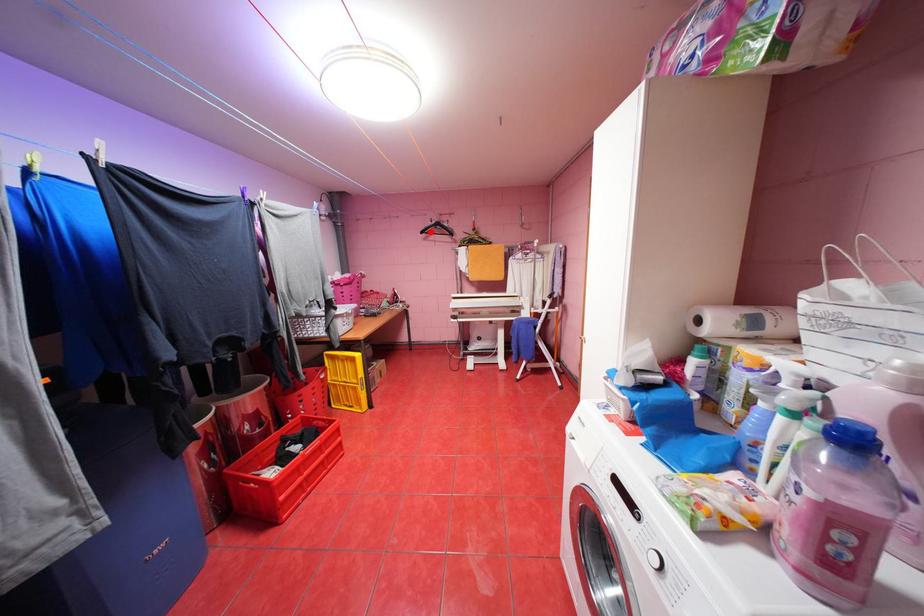
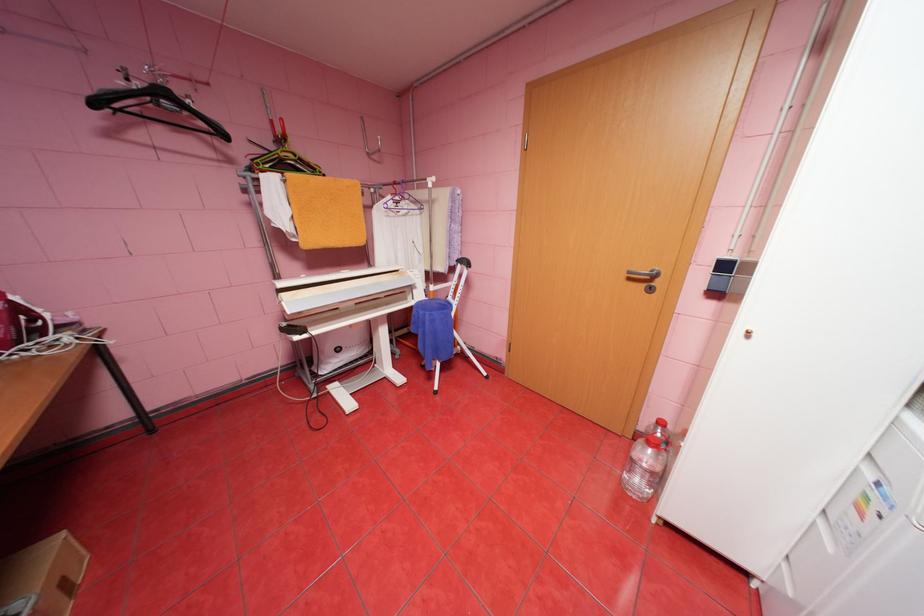
Question: A red point is marked in image1. In image2, is the corresponding 3D point closer to the camera or farther? Reply with the corresponding letter.

Choices:
 (A) The corresponding 3D point is closer.
 (B) The corresponding 3D point is farther.

Answer: (B)